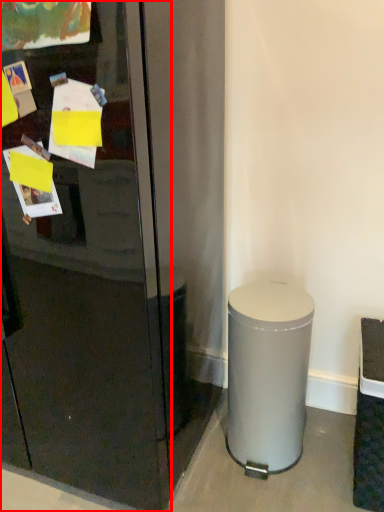
Question: From the image's perspective, considering the relative positions of glass door (annotated by the red box) and trash bin/can in the image provided, where is glass door (annotated by the red box) located with respect to the staircase?

Choices:
 (A) above
 (B) below

Answer: (A)